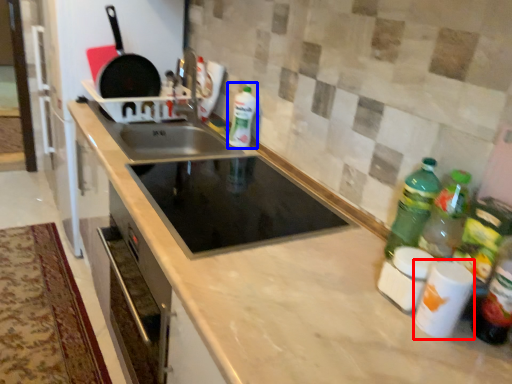
Question: Which point is further to the camera, appliance (highlighted by a red box) or bottle (highlighted by a blue box)?

Choices:
 (A) appliance
 (B) bottle

Answer: (B)